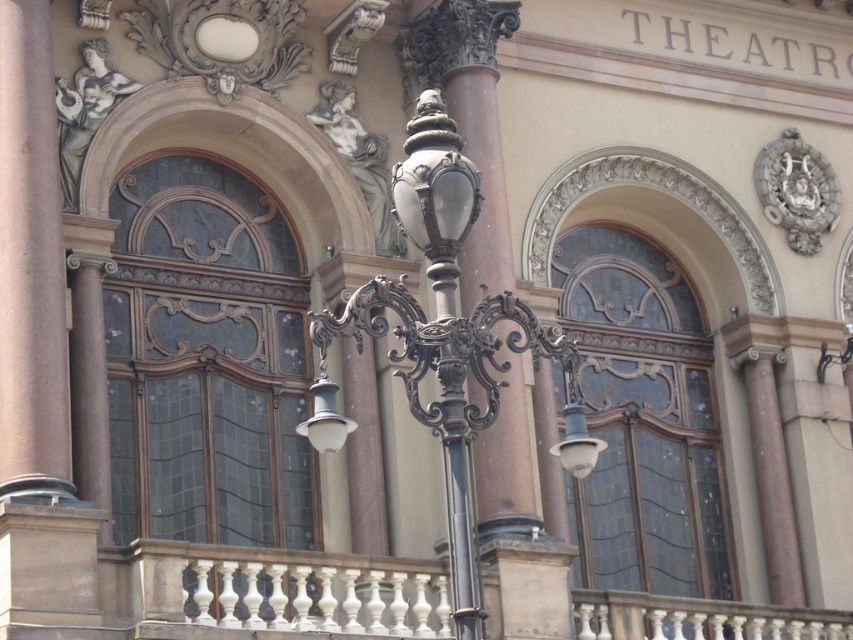
Question: Which point is closer to the camera?

Choices:
 (A) smooth pink stone column at left
 (B) polished bronze streetlight at center

Answer: (B)

Question: Which point is closer to the camera?

Choices:
 (A) smooth pink stone column at left
 (B) polished bronze streetlight at center

Answer: (B)

Question: Among these objects, which one is nearest to the camera?

Choices:
 (A) polished bronze streetlight at center
 (B) smooth pink stone column at left

Answer: (A)

Question: Can you confirm if polished bronze streetlight at center is positioned to the left of smooth pink stone column at left?

Choices:
 (A) no
 (B) yes

Answer: (A)

Question: Is polished bronze streetlight at center positioned before smooth pink stone column at left?

Choices:
 (A) no
 (B) yes

Answer: (B)

Question: Is polished bronze streetlight at center in front of smooth pink stone column at left?

Choices:
 (A) yes
 (B) no

Answer: (A)